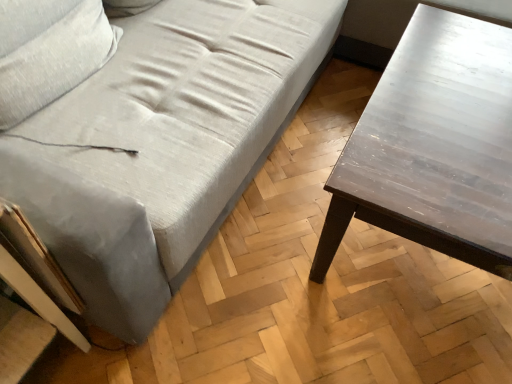
Question: From the image's perspective, is light gray fabric couch at center above dark brown wooden table at right?

Choices:
 (A) no
 (B) yes

Answer: (B)

Question: Is light gray fabric couch at center positioned behind dark brown wooden table at right?

Choices:
 (A) no
 (B) yes

Answer: (A)

Question: From a real-world perspective, is light gray fabric couch at center positioned under dark brown wooden table at right based on gravity?

Choices:
 (A) no
 (B) yes

Answer: (A)

Question: Is light gray fabric couch at center aimed at dark brown wooden table at right?

Choices:
 (A) yes
 (B) no

Answer: (A)

Question: From the image's perspective, is light gray fabric couch at center below dark brown wooden table at right?

Choices:
 (A) no
 (B) yes

Answer: (A)

Question: Can you confirm if light gray fabric couch at center is positioned to the left of dark brown wooden table at right?

Choices:
 (A) no
 (B) yes

Answer: (B)

Question: Considering the relative sizes of dark brown wooden table at right and light gray fabric couch at center in the image provided, is dark brown wooden table at right taller than light gray fabric couch at center?

Choices:
 (A) no
 (B) yes

Answer: (A)

Question: Considering the relative sizes of dark brown wooden table at right and light gray fabric couch at center in the image provided, is dark brown wooden table at right bigger than light gray fabric couch at center?

Choices:
 (A) no
 (B) yes

Answer: (A)

Question: Considering the relative positions of dark brown wooden table at right and light gray fabric couch at center in the image provided, is dark brown wooden table at right in front of light gray fabric couch at center?

Choices:
 (A) no
 (B) yes

Answer: (A)

Question: Is light gray fabric couch at center at the back of dark brown wooden table at right?

Choices:
 (A) yes
 (B) no

Answer: (A)

Question: Is dark brown wooden table at right at the right side of light gray fabric couch at center?

Choices:
 (A) no
 (B) yes

Answer: (B)

Question: Are dark brown wooden table at right and light gray fabric couch at center located far from each other?

Choices:
 (A) yes
 (B) no

Answer: (B)

Question: Looking at the image, does light gray fabric couch at center seem bigger or smaller compared to dark brown wooden table at right?

Choices:
 (A) small
 (B) big

Answer: (B)